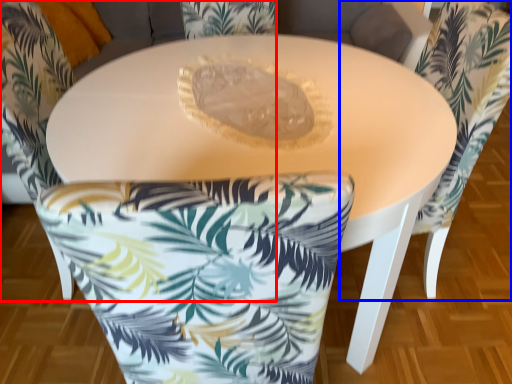
Question: Which object is closer to the camera taking this photo, chair (highlighted by a red box) or chair (highlighted by a blue box)?

Choices:
 (A) chair
 (B) chair

Answer: (A)